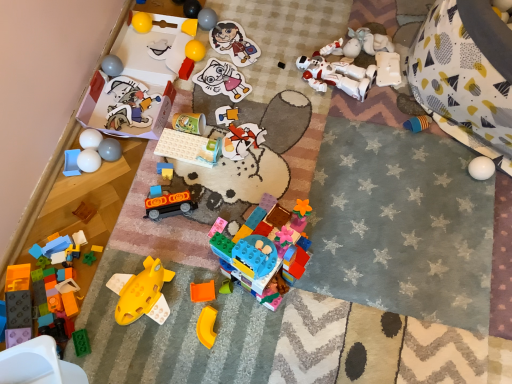
Identify the location of vacant space in front of matte plastic blocks at center, the 9th toy viewed from the left. (159, 226).